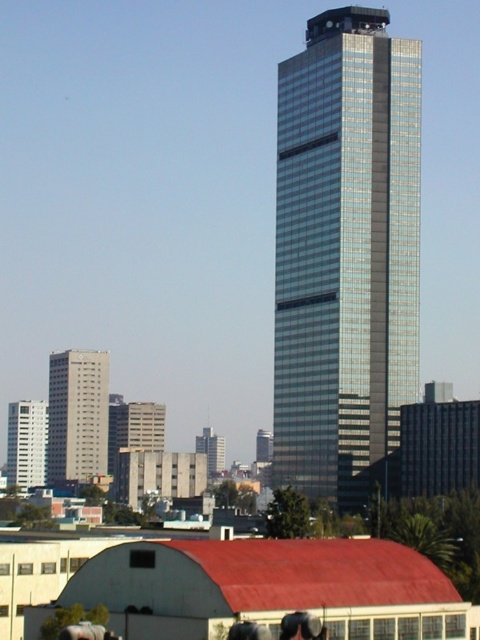
Does glossy glass skyscraper at center appear on the right side of smooth black hair at lower center?

Correct, you'll find glossy glass skyscraper at center to the right of smooth black hair at lower center.

Between glossy glass skyscraper at center and smooth black hair at lower center, which one has less height?

smooth black hair at lower center

Is point (364, 429) in front of point (300, 621)?

No, it is not.

The width and height of the screenshot is (480, 640). Identify the location of glossy glass skyscraper at center. (346, 253).

Can you confirm if gray concrete building at left is smaller than smooth black hair at lower center?

No.

Measure the distance between point (50, 481) and camera.

Point (50, 481) is 447.61 meters away from camera.

Identify the location of gray concrete building at left. The width and height of the screenshot is (480, 640). (76, 416).

Does point (379, 253) lie behind point (19, 456)?

No.

Can you confirm if glossy glass skyscraper at center is thinner than white glossy building at left?

Incorrect, glossy glass skyscraper at center's width is not less than white glossy building at left's.

This screenshot has width=480, height=640. In order to click on glossy glass skyscraper at center in this screenshot , I will do `click(346, 253)`.